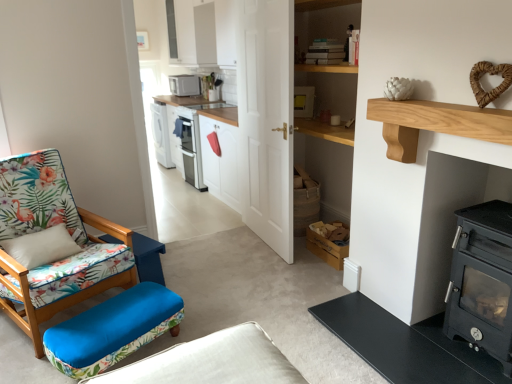
What is the approximate height of black matte wood burning stove at right?

black matte wood burning stove at right is 37.66 inches tall.

Describe the element at coordinates (435, 124) in the screenshot. The image size is (512, 384). I see `light brown wood at upper right` at that location.

Identify the location of blue fabric swivel chair at left. (112, 330).

This screenshot has width=512, height=384. What do you see at coordinates (148, 258) in the screenshot?
I see `blue fabric ottoman at lower left` at bounding box center [148, 258].

Locate an element on the screen. Image resolution: width=512 pixels, height=384 pixels. black matte wood burning stove at right is located at coordinates (482, 281).

Is blue fabric swivel chair at left to the left or to the right of light brown wood at upper right in the image?

From the image, it's evident that blue fabric swivel chair at left is to the left of light brown wood at upper right.

Which of these two, blue fabric swivel chair at left or light brown wood at upper right, is wider?

blue fabric swivel chair at left.

From the picture: From a real-world perspective, which is physically above, blue fabric swivel chair at left or light brown wood at upper right?

From a 3D spatial view, light brown wood at upper right is above.

Is blue fabric swivel chair at left not near light brown wood at upper right?

Yes, blue fabric swivel chair at left and light brown wood at upper right are quite far apart.

Is black matte wood burning stove at right far from blue fabric ottoman at lower left?

Absolutely, black matte wood burning stove at right is distant from blue fabric ottoman at lower left.

Is black matte wood burning stove at right outside of blue fabric ottoman at lower left?

Indeed, black matte wood burning stove at right is completely outside blue fabric ottoman at lower left.

Is black matte wood burning stove at right bigger than blue fabric ottoman at lower left?

Yes, black matte wood burning stove at right is bigger than blue fabric ottoman at lower left.

Can you confirm if black matte wood burning stove at right is shorter than blue fabric ottoman at lower left?

No, black matte wood burning stove at right is not shorter than blue fabric ottoman at lower left.

From a real-world perspective, is white glossy microwave at upper center over blue fabric swivel chair at left?

Yes, from a real-world perspective, white glossy microwave at upper center is on top of blue fabric swivel chair at left.

Where is `swivel chair on the right of white glossy microwave at upper center`? The image size is (512, 384). swivel chair on the right of white glossy microwave at upper center is located at coordinates (112, 330).

Which object is further away from the camera taking this photo, white glossy microwave at upper center or blue fabric swivel chair at left?

white glossy microwave at upper center is more distant.

Is blue floral fabric studio couch at lower left oriented away from floral fabric chair at left?

No, floral fabric chair at left is not at the back of blue floral fabric studio couch at lower left.

From a real-world perspective, is blue floral fabric studio couch at lower left over floral fabric chair at left?

Incorrect, from a real-world perspective, blue floral fabric studio couch at lower left is lower than floral fabric chair at left.

In the scene shown: Is blue floral fabric studio couch at lower left to the left or to the right of floral fabric chair at left in the image?

In the image, blue floral fabric studio couch at lower left appears on the right side of floral fabric chair at left.

What's the angular difference between blue floral fabric studio couch at lower left and floral fabric chair at left's facing directions?

The angle between the facing direction of blue floral fabric studio couch at lower left and the facing direction of floral fabric chair at left is 71.3 degrees.

Which is correct: white glossy microwave at upper center is inside blue floral fabric studio couch at lower left, or outside of it?

white glossy microwave at upper center is outside blue floral fabric studio couch at lower left.

Considering the sizes of objects white glossy microwave at upper center and blue floral fabric studio couch at lower left in the image provided, who is smaller, white glossy microwave at upper center or blue floral fabric studio couch at lower left?

white glossy microwave at upper center.

Considering the sizes of white glossy microwave at upper center and blue floral fabric studio couch at lower left in the image, is white glossy microwave at upper center taller or shorter than blue floral fabric studio couch at lower left?

white glossy microwave at upper center is shorter than blue floral fabric studio couch at lower left.

Can you confirm if white glossy microwave at upper center is wider than blue floral fabric studio couch at lower left?

In fact, white glossy microwave at upper center might be narrower than blue floral fabric studio couch at lower left.

Considering the relative positions of blue fabric swivel chair at left and floral fabric chair at left in the image provided, is blue fabric swivel chair at left to the right of floral fabric chair at left from the viewer's perspective?

Indeed, blue fabric swivel chair at left is positioned on the right side of floral fabric chair at left.

At what (x,y) coordinates should I click in order to perform the action: click on swivel chair that is below the floral fabric chair at left (from the image's perspective). Please return your answer as a coordinate pair (x, y). This screenshot has width=512, height=384. Looking at the image, I should click on (112, 330).

Considering the relative sizes of blue fabric swivel chair at left and floral fabric chair at left in the image provided, is blue fabric swivel chair at left smaller than floral fabric chair at left?

Yes.

Is the surface of blue fabric swivel chair at left in direct contact with floral fabric chair at left?

No, blue fabric swivel chair at left is not beside floral fabric chair at left.

Does point (198, 86) come in front of point (469, 284)?

No, it is behind (469, 284).

Is white glossy microwave at upper center positioned far away from black matte wood burning stove at right?

Yes, white glossy microwave at upper center is far from black matte wood burning stove at right.

Locate an element on the screen. Image resolution: width=512 pixels, height=384 pixels. appliance that appears behind the black matte wood burning stove at right is located at coordinates pyautogui.click(x=184, y=85).

How many degrees apart are the facing directions of white glossy microwave at upper center and black matte wood burning stove at right?

The facing directions of white glossy microwave at upper center and black matte wood burning stove at right are 1.16 degrees apart.

Where is `shelf on the right of blue fabric swivel chair at left`? shelf on the right of blue fabric swivel chair at left is located at coordinates (435, 124).

I want to click on table located below the black matte wood burning stove at right (from the image's perspective), so click(x=148, y=258).

In the scene shown: From the image, which object appears to be nearer to blue floral fabric studio couch at lower left, blue fabric swivel chair at left or black matte wood burning stove at right?

blue fabric swivel chair at left is positioned closer to the anchor blue floral fabric studio couch at lower left.

Which object lies further to the anchor point black matte wood burning stove at right, light brown wood at upper right or floral fabric chair at left?

floral fabric chair at left.

From the image, which object appears to be farther from light brown wood at upper right, blue fabric swivel chair at left or black matte wood burning stove at right?

Based on the image, blue fabric swivel chair at left appears to be further to light brown wood at upper right.

When comparing their distances from floral fabric chair at left, does black matte wood burning stove at right or light brown wood at upper right seem closer?

Among the two, light brown wood at upper right is located nearer to floral fabric chair at left.

Which object lies further to the anchor point light brown wood at upper right, floral fabric chair at left or white glossy microwave at upper center?

white glossy microwave at upper center.

Estimate the real-world distances between objects in this image. Which object is closer to light brown wood at upper right, floral fabric chair at left or blue fabric swivel chair at left?

blue fabric swivel chair at left.

Considering their positions, is white glossy microwave at upper center positioned further to blue fabric ottoman at lower left than light brown wood at upper right?

The object further to blue fabric ottoman at lower left is white glossy microwave at upper center.

When comparing their distances from black matte wood burning stove at right, does white glossy microwave at upper center or light brown wood at upper right seem further?

Based on the image, white glossy microwave at upper center appears to be further to black matte wood burning stove at right.

I want to click on swivel chair between blue floral fabric studio couch at lower left and white glossy microwave at upper center in the front-back direction, so click(112, 330).

Locate an element on the screen. swivel chair between blue fabric ottoman at lower left and light brown wood at upper right is located at coordinates (112, 330).

Identify the location of swivel chair located between floral fabric chair at left and light brown wood at upper right in the left-right direction. The width and height of the screenshot is (512, 384). (112, 330).

Locate an element on the screen. This screenshot has width=512, height=384. table between black matte wood burning stove at right and white glossy microwave at upper center in the front-back direction is located at coordinates (148, 258).